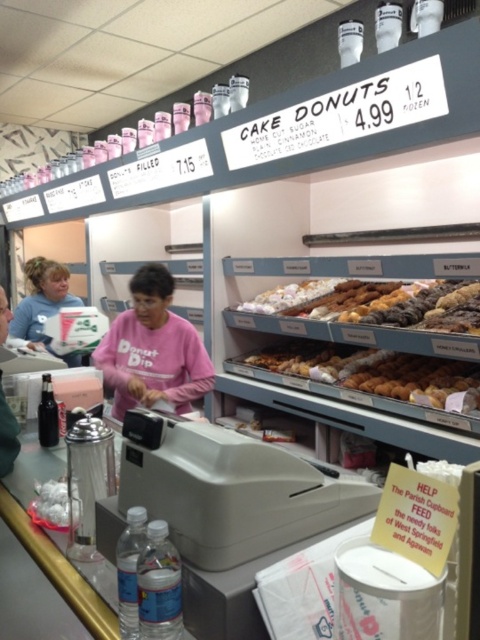
Question: Which point is closer to the camera taking this photo?

Choices:
 (A) (144, 296)
 (B) (260, 358)
 (C) (50, 524)
 (D) (36, 339)

Answer: (C)

Question: Is glazed sugar donut at center above matte blue shirt at upper left?

Choices:
 (A) yes
 (B) no

Answer: (A)

Question: Which point is closer to the camera taking this photo?

Choices:
 (A) (139, 333)
 (B) (44, 525)

Answer: (B)

Question: Is pink cotton shirt at center closer to the viewer compared to white plastic bag at lower left?

Choices:
 (A) no
 (B) yes

Answer: (A)

Question: Which object appears closest to the camera in this image?

Choices:
 (A) golden brown doughnut at center
 (B) matte blue shirt at upper left
 (C) glazed sugar donut at center

Answer: (A)

Question: Is matte blue shirt at upper left behind white plastic bag at lower left?

Choices:
 (A) yes
 (B) no

Answer: (A)